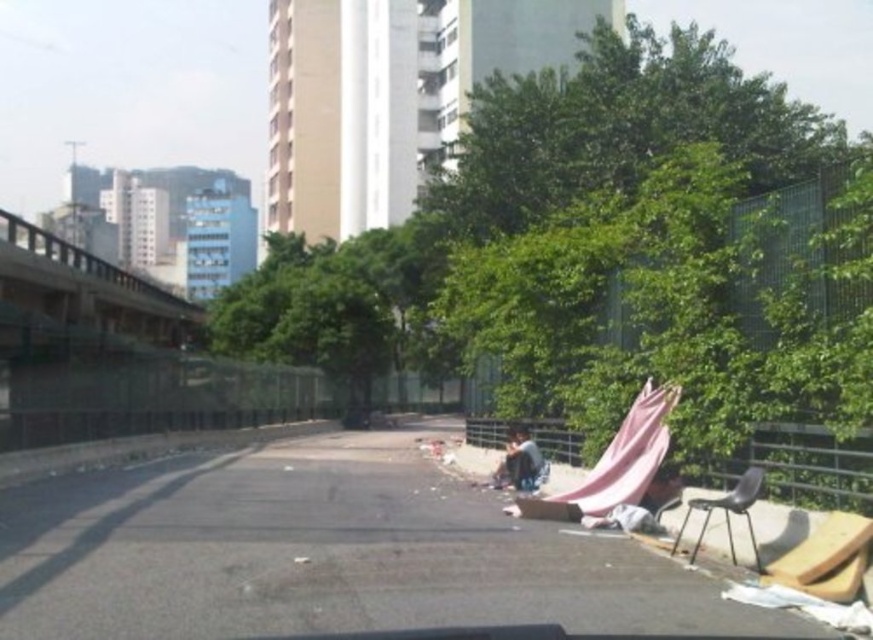
Question: Which point is closer to the camera taking this photo?

Choices:
 (A) (150, 314)
 (B) (741, 493)

Answer: (B)

Question: Which point appears farthest from the camera in this image?

Choices:
 (A) (727, 522)
 (B) (33, 234)

Answer: (B)

Question: Can you confirm if brushed metal overpass at upper left is positioned to the left of black plastic chair at lower right?

Choices:
 (A) no
 (B) yes

Answer: (B)

Question: Can you confirm if brushed metal overpass at upper left is positioned above black plastic chair at lower right?

Choices:
 (A) yes
 (B) no

Answer: (A)

Question: Is brushed metal overpass at upper left smaller than black plastic chair at lower right?

Choices:
 (A) no
 (B) yes

Answer: (A)